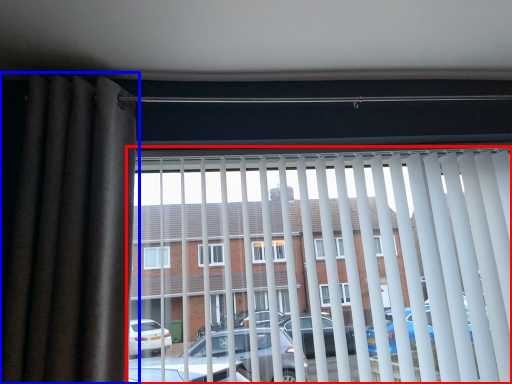
Question: Which of the following is the farthest to the observer, window blind (highlighted by a red box) or curtain (highlighted by a blue box)?

Choices:
 (A) window blind
 (B) curtain

Answer: (A)